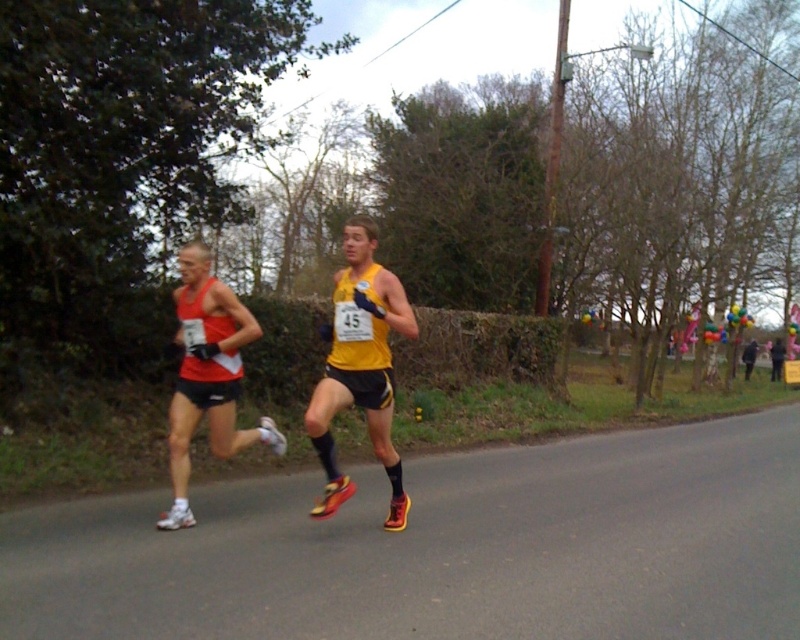
Can you confirm if yellow matte running shoe at center is shorter than matte red tank top at left?

Yes, yellow matte running shoe at center is shorter than matte red tank top at left.

Is point (377, 349) in front of point (169, 424)?

That is True.

Is point (374, 272) closer to viewer compared to point (229, 445)?

That is True.

Locate an element on the screen. This screenshot has width=800, height=640. yellow matte running shoe at center is located at coordinates (360, 368).

Can you confirm if matte red tank top at left is thinner than black matte jacket at right?

In fact, matte red tank top at left might be wider than black matte jacket at right.

Does matte red tank top at left appear under black matte jacket at right?

Actually, matte red tank top at left is above black matte jacket at right.

This screenshot has height=640, width=800. I want to click on matte red tank top at left, so pos(208,376).

Locate an element on the screen. This screenshot has height=640, width=800. matte red tank top at left is located at coordinates (208, 376).

Is yellow matte running shoe at center positioned behind black matte jacket at right?

No, yellow matte running shoe at center is in front of black matte jacket at right.

At what (x,y) coordinates should I click in order to perform the action: click on yellow matte running shoe at center. Please return your answer as a coordinate pair (x, y). Looking at the image, I should click on (360, 368).

Identify the location of yellow matte running shoe at center. This screenshot has height=640, width=800. (360, 368).